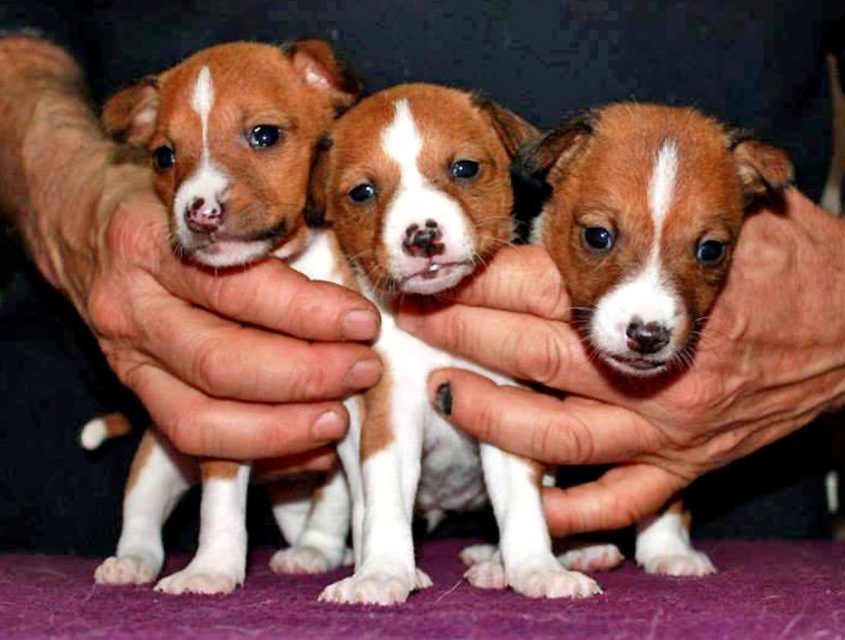
Between point (771, 326) and point (548, 200), which one is positioned behind?

The point (548, 200) is behind.

Is point (444, 294) more distant than point (658, 337)?

Yes.

This screenshot has height=640, width=845. Find the location of `smooth skin hand at center`. smooth skin hand at center is located at coordinates (642, 378).

Is smooth skin hand at center wider than smooth skin hand at left?

Incorrect, smooth skin hand at center's width does not surpass smooth skin hand at left's.

Image resolution: width=845 pixels, height=640 pixels. Find the location of `smooth skin hand at center`. smooth skin hand at center is located at coordinates (642, 378).

Does point (35, 205) come behind point (718, 164)?

Yes, it is behind point (718, 164).

Does smooth skin hand at left have a lesser height compared to brown furry puppy at center?

Incorrect, smooth skin hand at left's height does not fall short of brown furry puppy at center's.

This screenshot has width=845, height=640. What do you see at coordinates (172, 285) in the screenshot?
I see `smooth skin hand at left` at bounding box center [172, 285].

Find the location of a particular element. smooth skin hand at left is located at coordinates pyautogui.click(x=172, y=285).